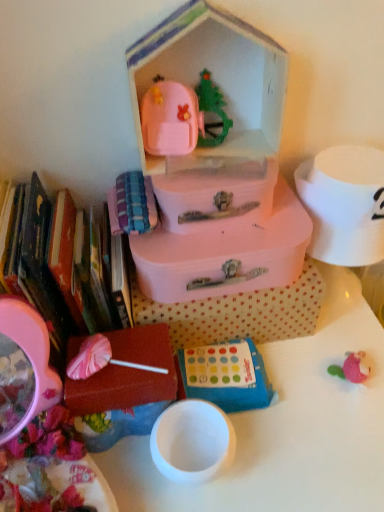
What are the coordinates of `free region under pink plastic suitcase at upper center (from a real-world perspective)` in the screenshot? It's located at click(217, 165).